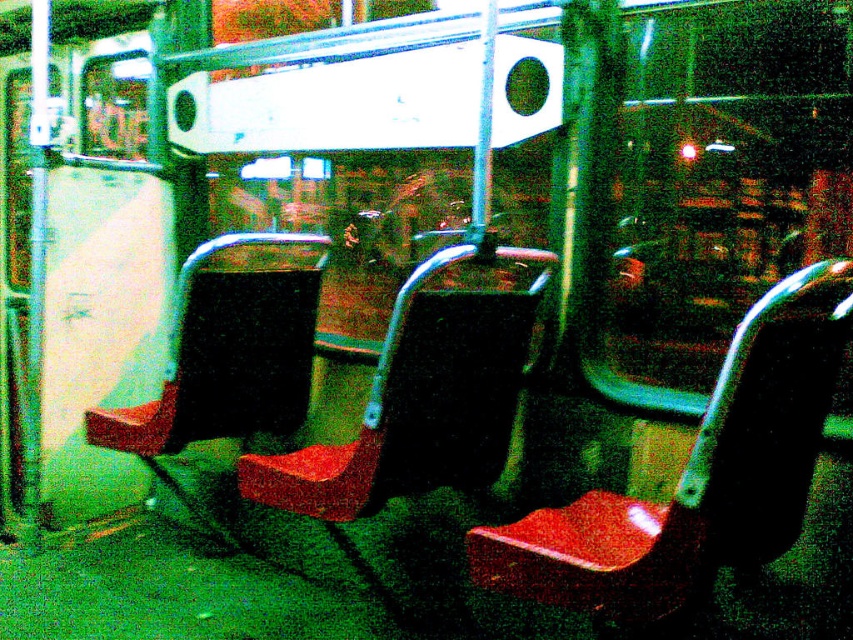
Can you confirm if matte plastic chair at center is positioned to the left of matte red seat at center?

In fact, matte plastic chair at center is to the right of matte red seat at center.

Is point (773, 356) closer to viewer compared to point (505, 326)?

Yes, it is.

At what (x,y) coordinates should I click in order to perform the action: click on matte plastic chair at center. Please return your answer as a coordinate pair (x, y). Looking at the image, I should click on (697, 476).

Between matte red seat at center and matte black seat at left, which one appears on the left side from the viewer's perspective?

matte black seat at left

Which of these two, matte red seat at center or matte black seat at left, stands taller?

Standing taller between the two is matte black seat at left.

Does point (263, 493) come farther from viewer compared to point (198, 401)?

No, (263, 493) is in front of (198, 401).

I want to click on matte red seat at center, so click(416, 404).

Is point (753, 454) behind point (231, 326)?

That is False.

The width and height of the screenshot is (853, 640). Describe the element at coordinates (697, 476) in the screenshot. I see `matte plastic chair at center` at that location.

At what (x,y) coordinates should I click in order to perform the action: click on matte plastic chair at center. Please return your answer as a coordinate pair (x, y). Image resolution: width=853 pixels, height=640 pixels. Looking at the image, I should click on (697, 476).